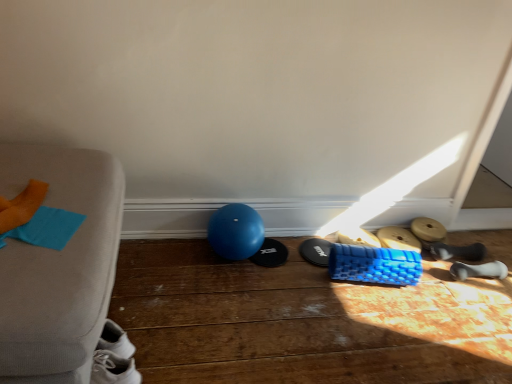
Where is `free space to the left of blue rubber ball at center`? The height and width of the screenshot is (384, 512). free space to the left of blue rubber ball at center is located at coordinates (181, 259).